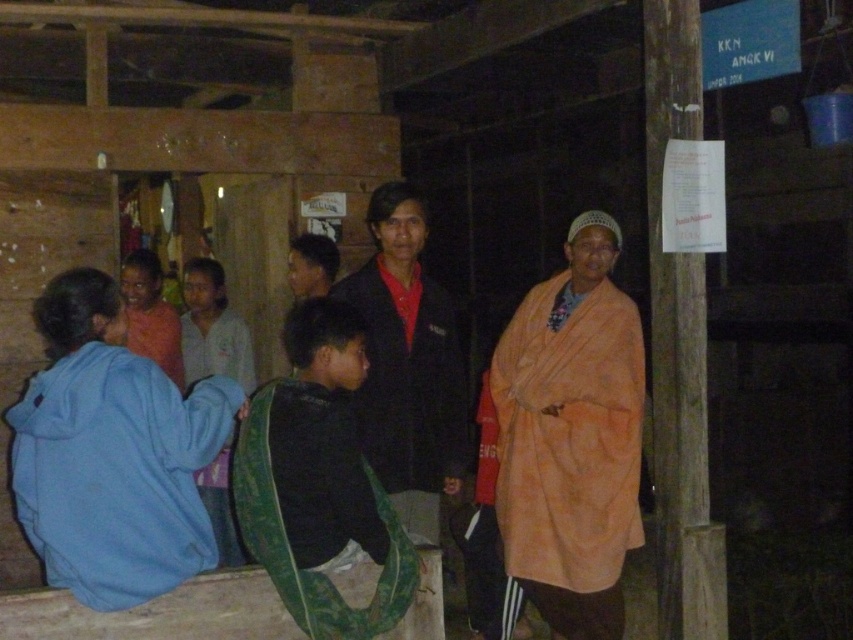
Question: Which of the following is the closest to the observer?

Choices:
 (A) light blue fabric at left
 (B) orange fabric at center
 (C) blue fleece jacket at lower left

Answer: (C)

Question: Is blue fleece jacket at lower left thinner than green fabric bag at center?

Choices:
 (A) no
 (B) yes

Answer: (A)

Question: Among these points, which one is farthest from the camera?

Choices:
 (A) (404, 380)
 (B) (630, 316)

Answer: (B)

Question: Is green fabric bag at center thinner than matte orange robe at center?

Choices:
 (A) yes
 (B) no

Answer: (B)

Question: Which point is closer to the camera taking this photo?

Choices:
 (A) pos(215,276)
 (B) pos(386,516)
 (C) pos(229,397)
 (D) pos(142,252)

Answer: (B)

Question: Can you confirm if matte black jacket at center is smaller than matte orange robe at center?

Choices:
 (A) no
 (B) yes

Answer: (A)